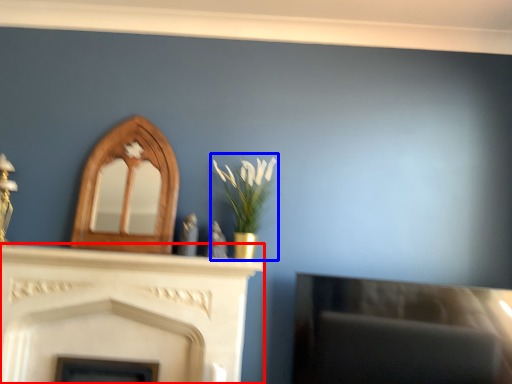
Question: Which object appears closest to the camera in this image, fireplace (highlighted by a red box) or floral arrangement (highlighted by a blue box)?

Choices:
 (A) fireplace
 (B) floral arrangement

Answer: (A)